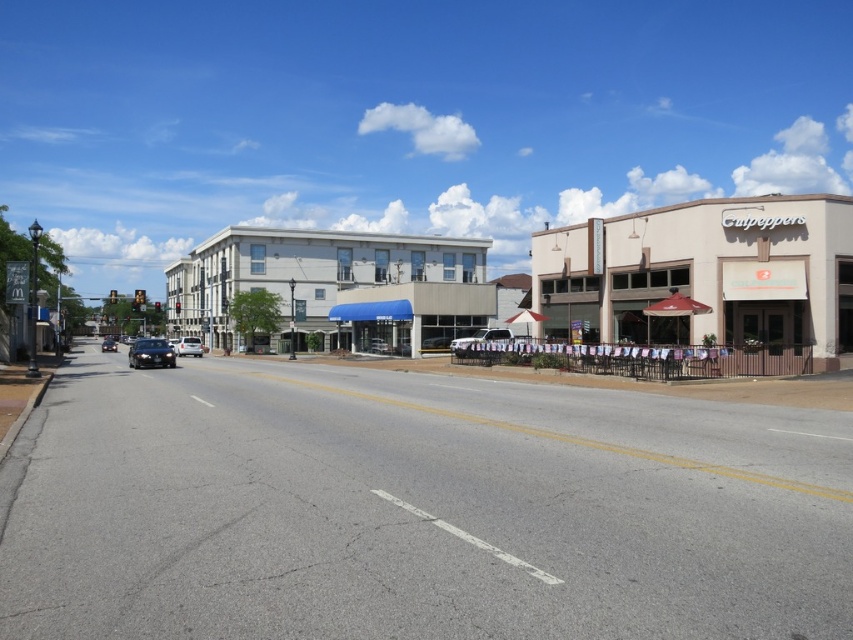
Question: Considering the real-world distances, which object is closest to the shiny black sedan at left?

Choices:
 (A) satin silver suv at center
 (B) silver metallic sedan at center

Answer: (A)

Question: Based on their relative distances, which object is farther from the shiny black sedan at center?

Choices:
 (A) satin silver suv at center
 (B) silver metallic sedan at center
 (C) shiny black sedan at left
 (D) beige/textured building at right

Answer: (D)

Question: Can you confirm if beige/textured building at right is positioned below silver metallic sedan at center?

Choices:
 (A) no
 (B) yes

Answer: (A)

Question: Among these objects, which one is nearest to the camera?

Choices:
 (A) shiny black sedan at center
 (B) shiny black sedan at left

Answer: (B)

Question: Can you confirm if shiny black sedan at left is positioned above silver metallic sedan at center?

Choices:
 (A) yes
 (B) no

Answer: (A)

Question: Can you confirm if beige/textured building at right is positioned above satin silver suv at center?

Choices:
 (A) no
 (B) yes

Answer: (B)